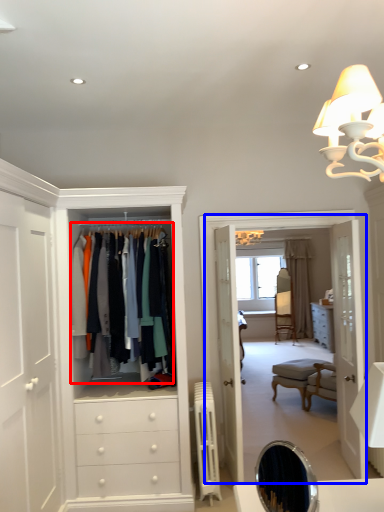
Question: Which object is further to the camera taking this photo, clothing (highlighted by a red box) or boutique (highlighted by a blue box)?

Choices:
 (A) clothing
 (B) boutique

Answer: (B)